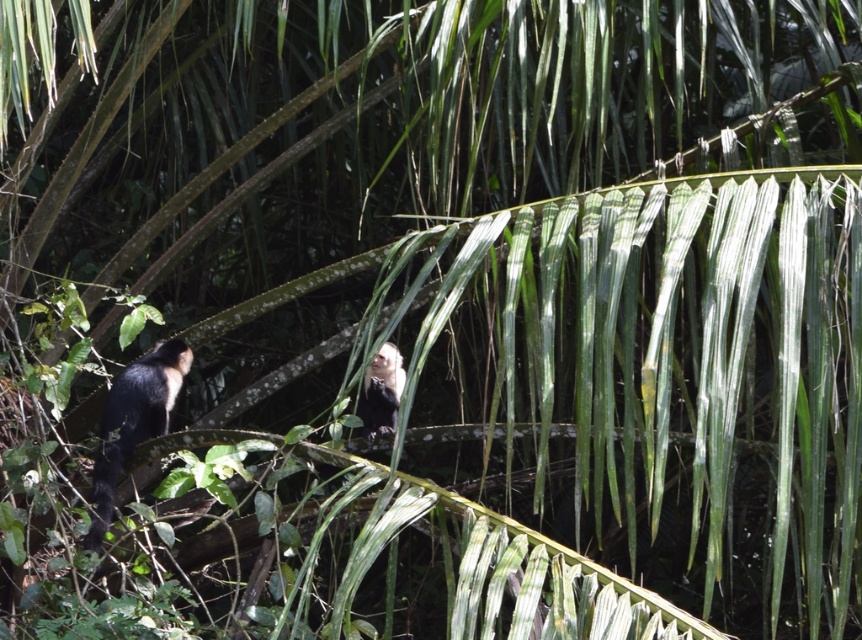
Does black fur monkey at left have a lesser height compared to white fur monkey at upper center?

Incorrect, black fur monkey at left's height does not fall short of white fur monkey at upper center's.

Is black fur monkey at left below white fur monkey at upper center?

Correct, black fur monkey at left is located below white fur monkey at upper center.

Between point (130, 388) and point (398, 401), which one is positioned in front?

Point (398, 401)

Where is `black fur monkey at left`? black fur monkey at left is located at coordinates (133, 420).